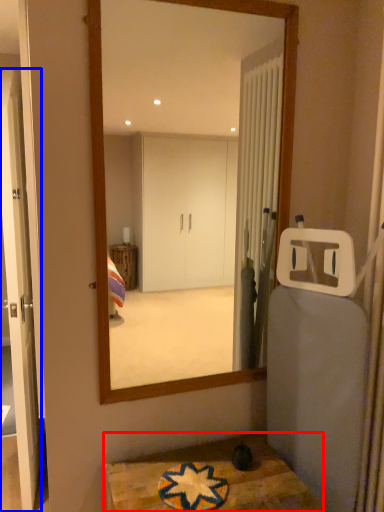
Question: Among these objects, which one is nearest to the camera, table (highlighted by a red box) or door (highlighted by a blue box)?

Choices:
 (A) table
 (B) door

Answer: (A)